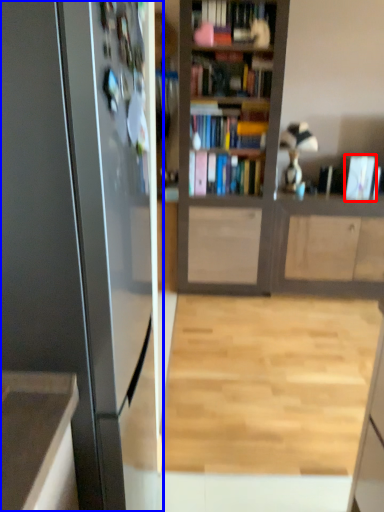
Question: Among these objects, which one is farthest to the camera, book (highlighted by a red box) or appliance (highlighted by a blue box)?

Choices:
 (A) book
 (B) appliance

Answer: (A)